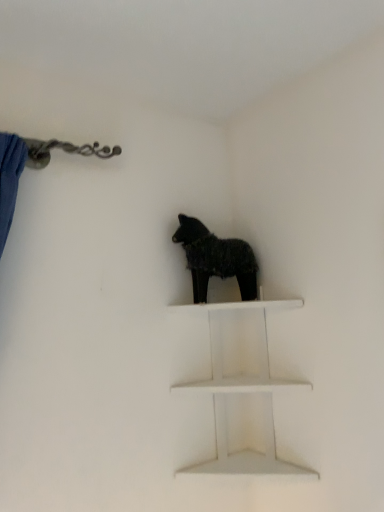
Question: Is point (180, 309) positioned closer to the camera than point (211, 243)?

Choices:
 (A) farther
 (B) closer

Answer: (A)

Question: From a real-world perspective, is white matte shelf at center positioned above or below black furry dog at center?

Choices:
 (A) below
 (B) above

Answer: (A)

Question: From the image's perspective, is white matte shelf at center above or below black furry dog at center?

Choices:
 (A) above
 (B) below

Answer: (B)

Question: Would you say black furry dog at center is inside or outside white matte shelf at center?

Choices:
 (A) inside
 (B) outside

Answer: (B)

Question: Considering the positions of black furry dog at center and white matte shelf at center in the image, is black furry dog at center wider or thinner than white matte shelf at center?

Choices:
 (A) wide
 (B) thin

Answer: (B)

Question: Considering their positions, is black furry dog at center located in front of or behind white matte shelf at center?

Choices:
 (A) behind
 (B) front

Answer: (A)

Question: In the image, is black furry dog at center on the left side or the right side of white matte shelf at center?

Choices:
 (A) right
 (B) left

Answer: (B)